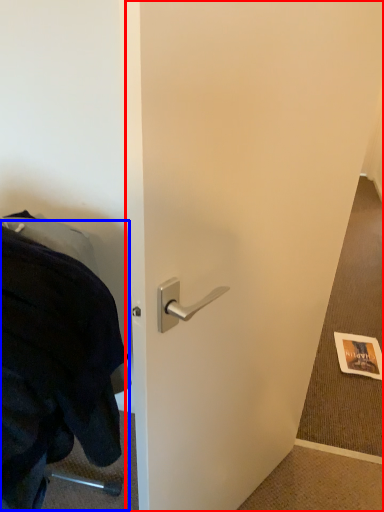
Question: Which point is further to the camera, door (highlighted by a red box) or blanket (highlighted by a blue box)?

Choices:
 (A) door
 (B) blanket

Answer: (B)